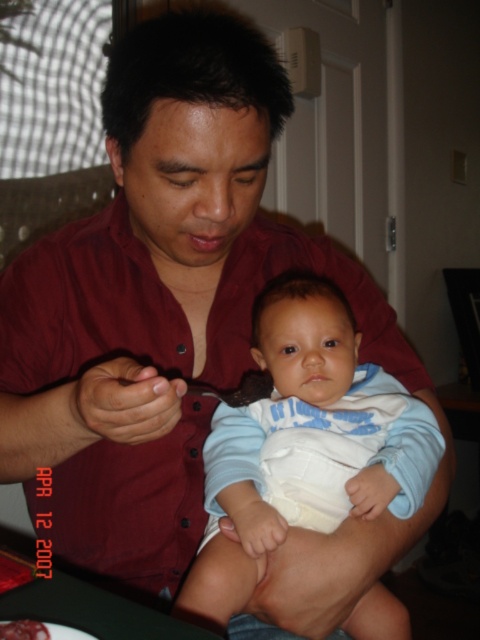
You are a photographer setting up for a family photo. The light blue cotton onesie at center is crucial for the shot. Where exactly should you position your camera to capture the onesie perfectly?

The light blue cotton onesie at center is located at coordinates point (304,444). Position your camera to focus on that point to capture it perfectly.

You are a caregiver holding a baby wearing the light blue cotton onesie at center. You need to place a toy on a shelf behind you that is 30 inches away from the baby. Can the toy be placed safely without the baby reaching it?

The light blue cotton onesie at center is 26.58 inches away from the viewer. Since the shelf is 30 inches away from the baby, the toy can be placed safely as the distance is beyond the baby reach.

You are a photographer trying to capture the baby in the light blue cotton onesie at center. You need to place a sticker exactly at the point with coordinates (304, 444). Where should you place the sticker on the baby?

The point with coordinates (304, 444) is located on the light blue cotton onesie at center, so you should place the sticker on the baby where the light blue cotton onesie at center is.